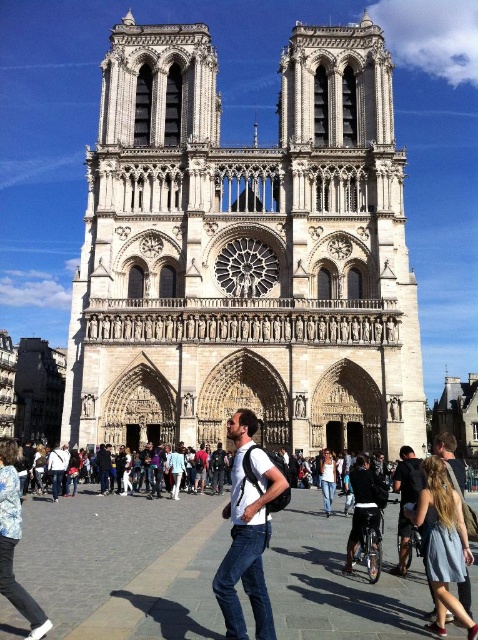
Question: Does denim skirt at lower right have a smaller size compared to black matte jacket at center?

Choices:
 (A) no
 (B) yes

Answer: (B)

Question: Among these points, which one is nearest to the camera?

Choices:
 (A) (249, 586)
 (B) (324, 502)

Answer: (A)

Question: Considering the real-world distances, which object is farthest from the white stone cathedral at center?

Choices:
 (A) white matte shirt at center
 (B) black matte jacket at center
 (C) denim skirt at lower right

Answer: (C)

Question: Which is farther from the white matte shirt at center?

Choices:
 (A) white stone cathedral at center
 (B) denim jeans at center

Answer: (A)

Question: Is denim skirt at lower right above denim jeans at center?

Choices:
 (A) no
 (B) yes

Answer: (B)

Question: Can you confirm if white stone cathedral at center is positioned to the left of denim jeans at center?

Choices:
 (A) yes
 (B) no

Answer: (A)